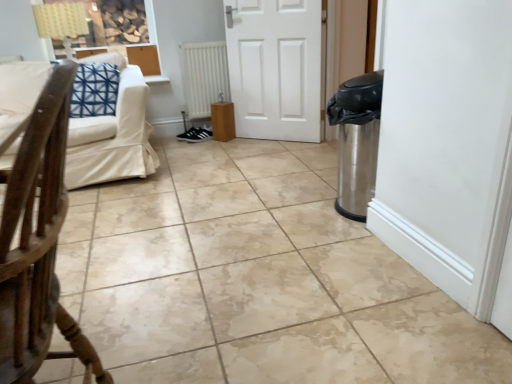
Where is `free location in front of black suede sneakers at center`? This screenshot has height=384, width=512. free location in front of black suede sneakers at center is located at coordinates (190, 145).